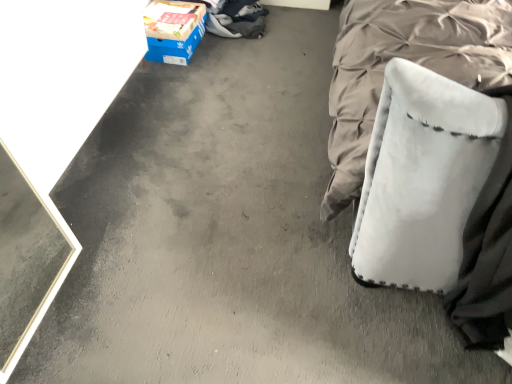
Locate an element on the screen. vacant space that's between blue cardboard box at upper left and white fabric swivel chair at right is located at coordinates (260, 124).